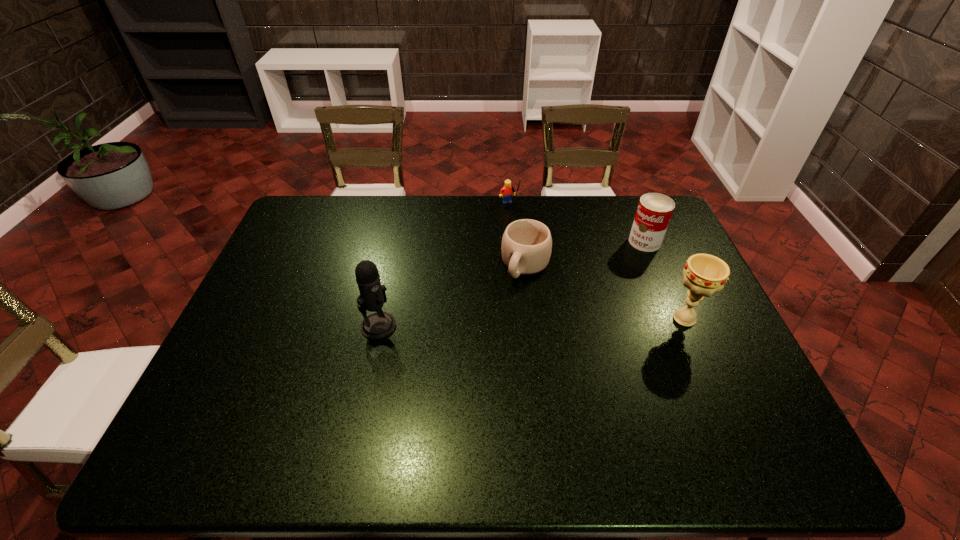
At what (x,y) coordinates should I click in order to perform the action: click on object that ranks as the fourth closest to the Lego. Please return your answer as a coordinate pair (x, y). The width and height of the screenshot is (960, 540). Looking at the image, I should click on (704, 274).

The width and height of the screenshot is (960, 540). In order to click on vacant space that satisfies the following two spatial constraints: 1. on the front side of the can; 2. on the left side of the Lego in this screenshot , I will do `click(512, 241)`.